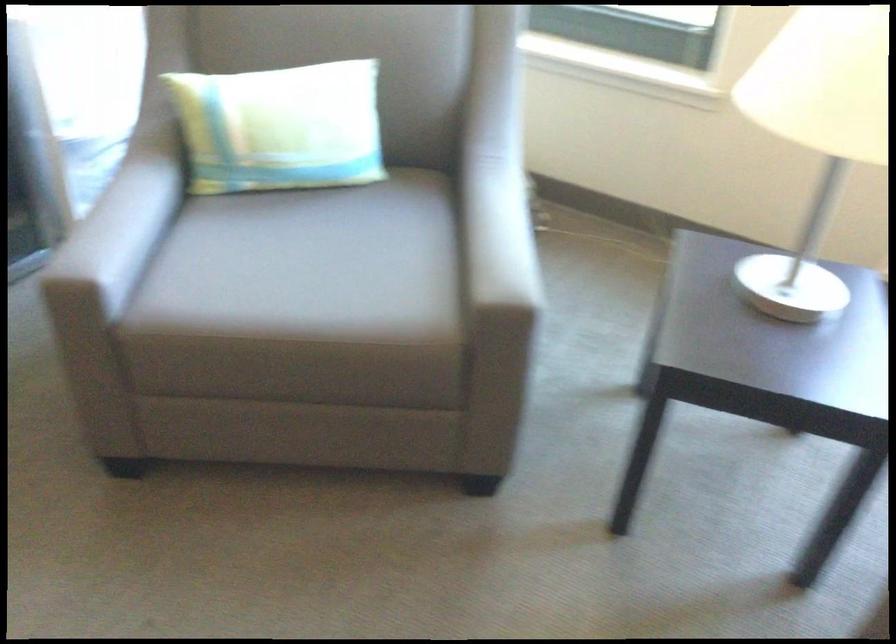
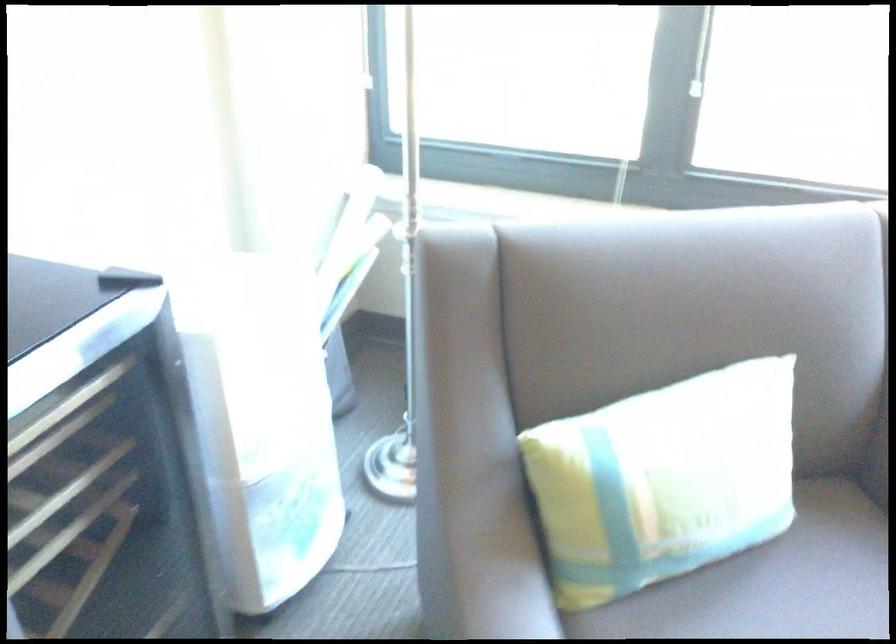
Based on the photo, the images are taken continuously from a first-person perspective. In which direction are you moving?

The cameraman walked toward left, forward.